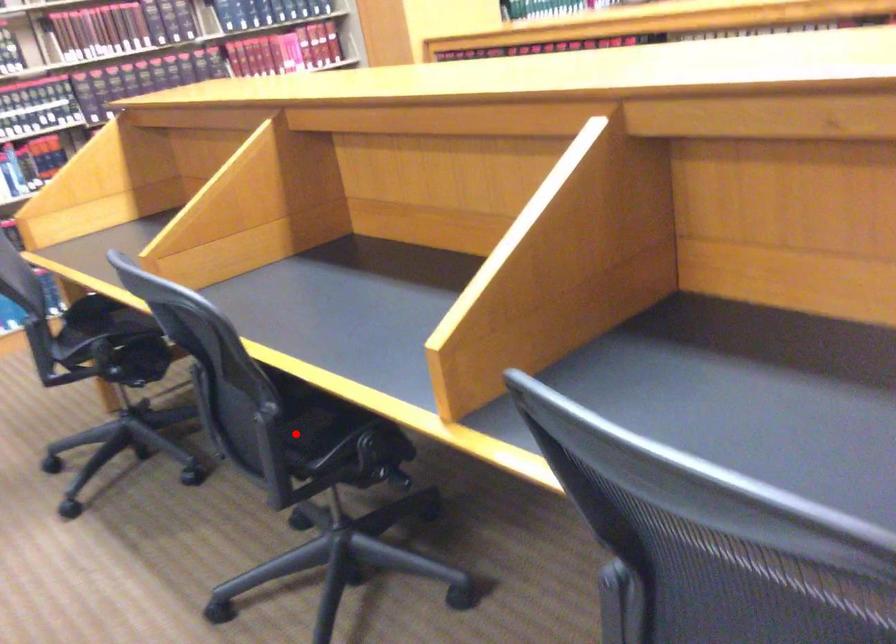
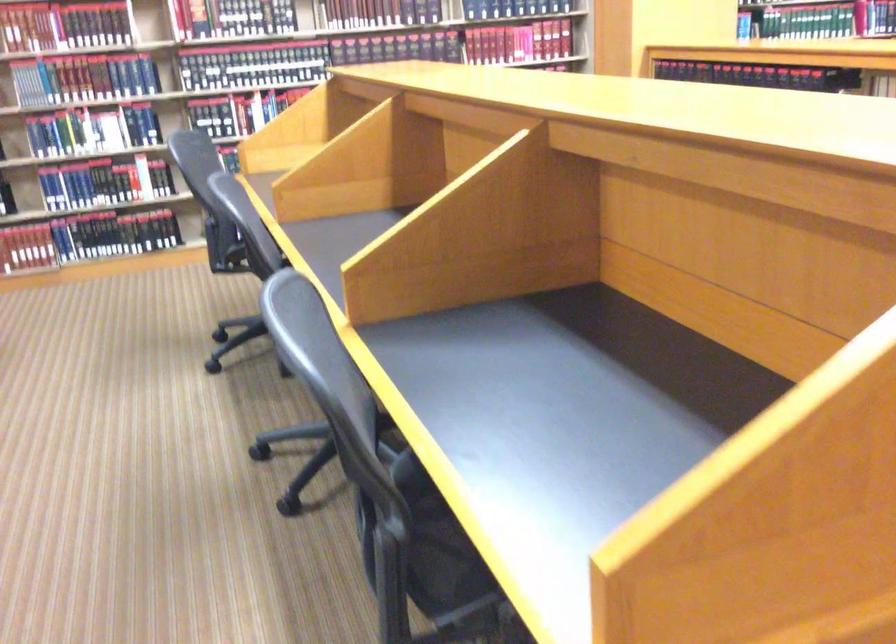
Question: I am providing you with two images of the same scene from different viewpoints. A red point is marked on the first image. At the location where the point appears in image 1, is it still visible in image 2?

Choices:
 (A) Yes
 (B) No

Answer: (B)